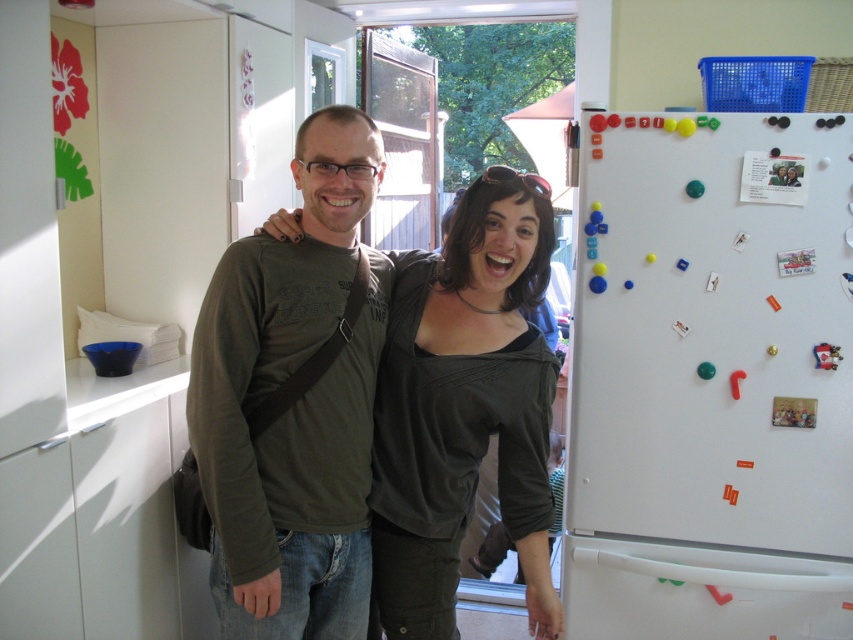
Question: Considering the relative positions of white matte refrigerator at right and matte olive green shirt at center in the image provided, where is white matte refrigerator at right located with respect to matte olive green shirt at center?

Choices:
 (A) left
 (B) right

Answer: (B)

Question: Is white matte refrigerator at right to the right of dark gray jersey at center from the viewer's perspective?

Choices:
 (A) yes
 (B) no

Answer: (A)

Question: Which is nearer to the matte olive green shirt at center?

Choices:
 (A) white matte refrigerator at right
 (B) dark gray jersey at center

Answer: (B)

Question: Which object is closer to the camera taking this photo?

Choices:
 (A) dark gray jersey at center
 (B) matte olive green shirt at center

Answer: (B)

Question: Is white matte refrigerator at right to the left of dark gray jersey at center from the viewer's perspective?

Choices:
 (A) yes
 (B) no

Answer: (B)

Question: Estimate the real-world distances between objects in this image. Which object is farther from the white matte refrigerator at right?

Choices:
 (A) dark gray jersey at center
 (B) matte olive green shirt at center

Answer: (B)